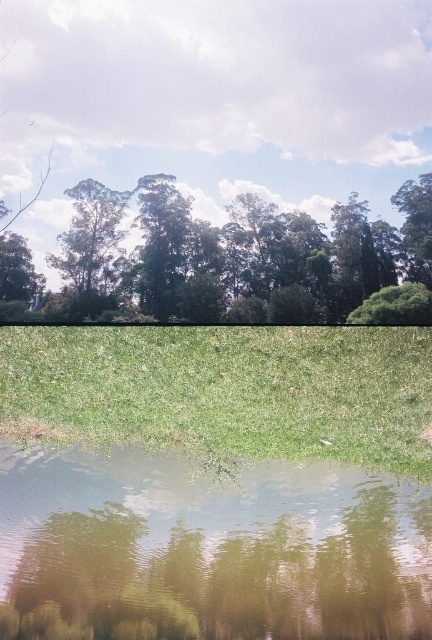
Does green grass at lower center have a smaller size compared to green leafy tree at upper center?

No.

Measure the distance between green grass at lower center and green leafy tree at upper center.

green grass at lower center and green leafy tree at upper center are 2.92 meters apart from each other.

Which is in front, point (425, 360) or point (95, 202)?

Point (425, 360) is in front.

Where is `green grass at lower center`? green grass at lower center is located at coordinates (225, 390).

Between point (387, 566) and point (111, 221), which one is positioned in front?

Point (111, 221)

Is green reflective water at lower center taller than green leafy tree at upper center?

Yes, green reflective water at lower center is taller than green leafy tree at upper center.

Which is behind, point (76, 493) or point (75, 205)?

Positioned behind is point (76, 493).

This screenshot has height=640, width=432. I want to click on green reflective water at lower center, so click(x=207, y=548).

Does green reflective water at lower center lie behind green grass at lower center?

Yes, green reflective water at lower center is behind green grass at lower center.

How far apart are green reflective water at lower center and green grass at lower center?

green reflective water at lower center and green grass at lower center are 9.17 feet apart from each other.

Is point (94, 486) positioned after point (259, 372)?

Yes, it is.

In order to click on green reflective water at lower center in this screenshot , I will do `click(207, 548)`.